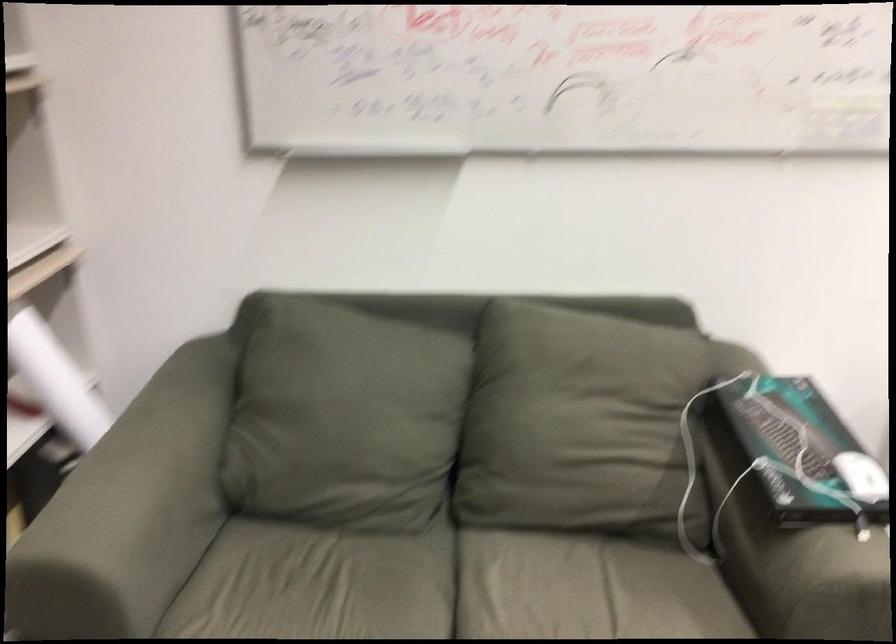
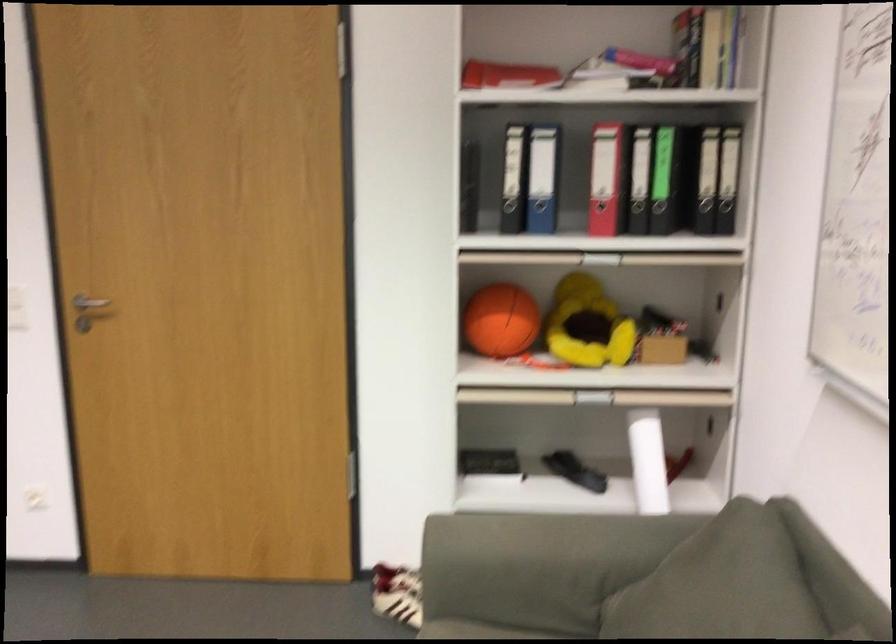
The point at [371,355] is marked in the first image. Where is the corresponding point in the second image?

(747, 592)